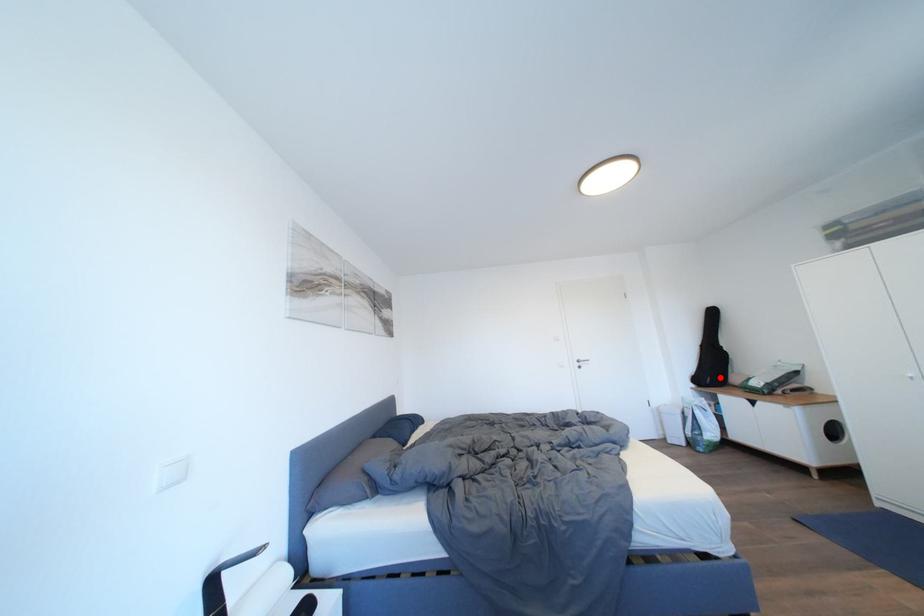
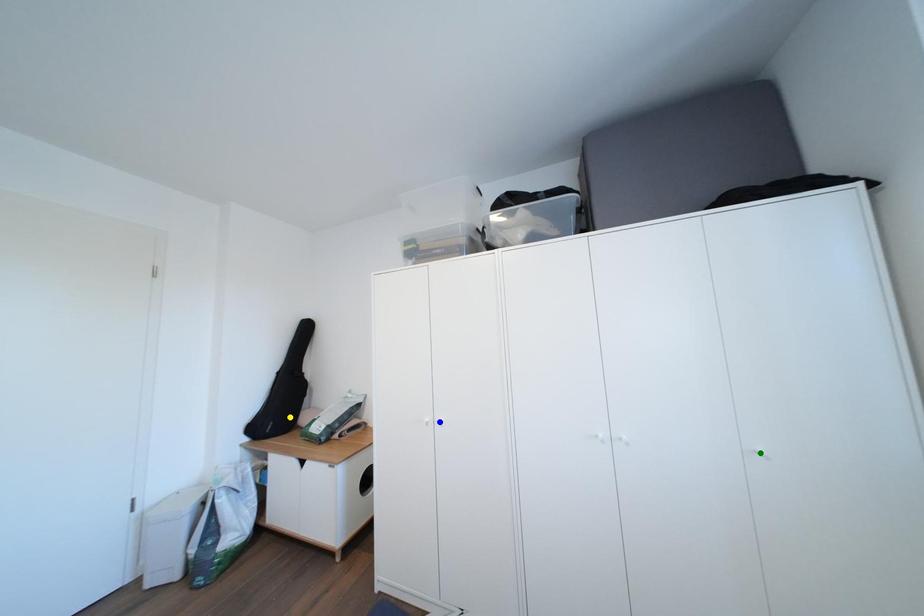
Question: I am providing you with two images of the same scene from different viewpoints. A red point is marked on the first image. You are given multiple points on the second image. Which mark in image 2 goes with the point in image 1?

Choices:
 (A) blue point
 (B) yellow point
 (C) green point

Answer: (B)